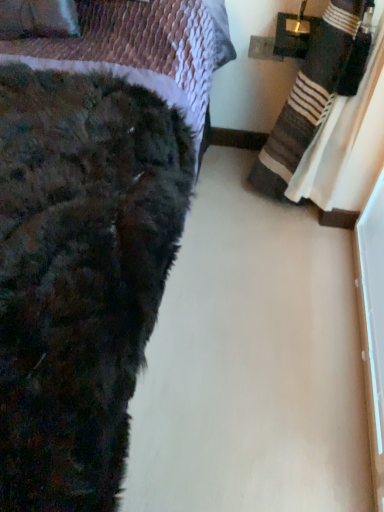
You are a GUI agent. You are given a task and a screenshot of the screen. Output one action in this format:
    pyautogui.click(x=<x>, y=<y>)
    Task: Click on the vacant space that's between fuzzy black blanket at lower left and striped cotton blanket at right
    The height and width of the screenshot is (512, 384).
    Given the screenshot: What is the action you would take?
    pyautogui.click(x=241, y=311)